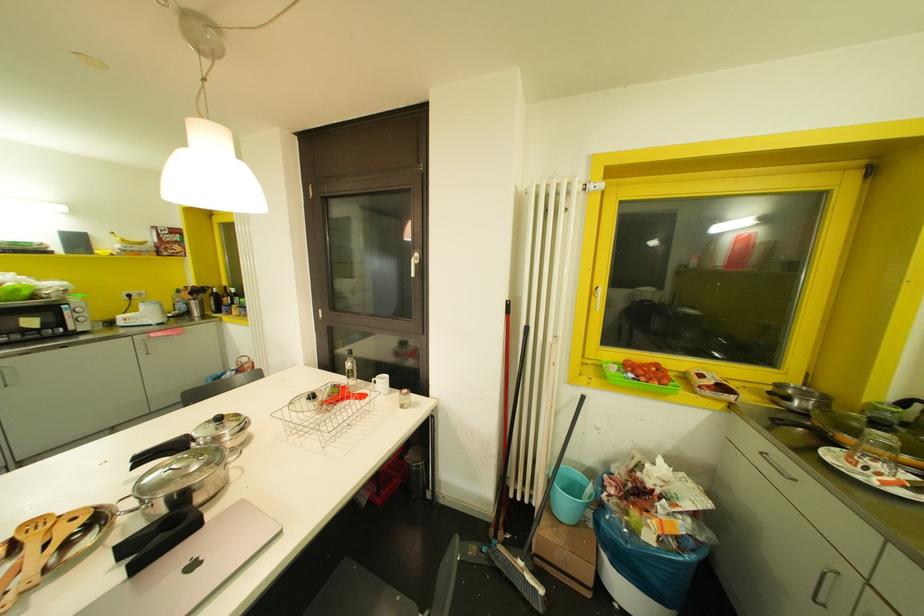
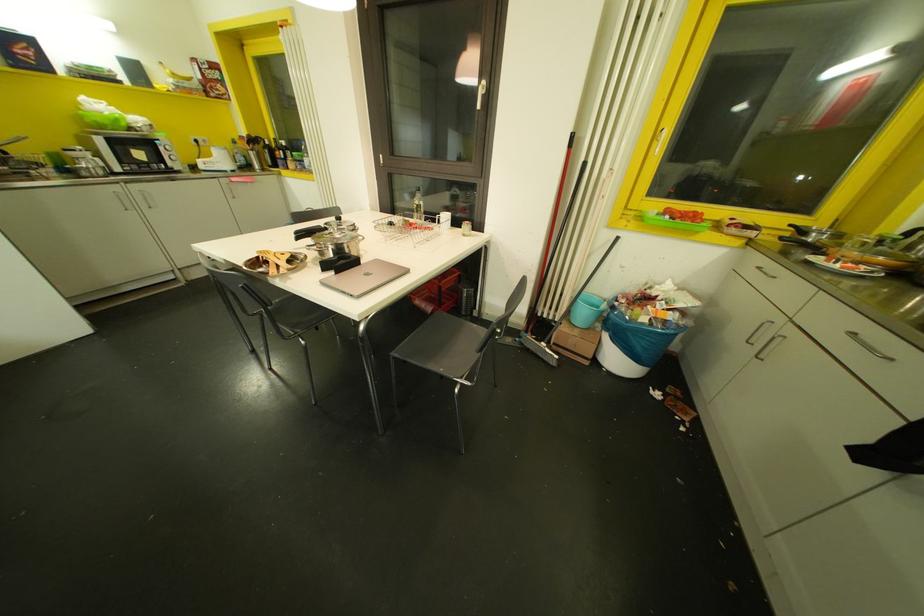
Question: How did the camera likely rotate?

Choices:
 (A) Left
 (B) Right
 (C) Up
 (D) Down

Answer: (D)